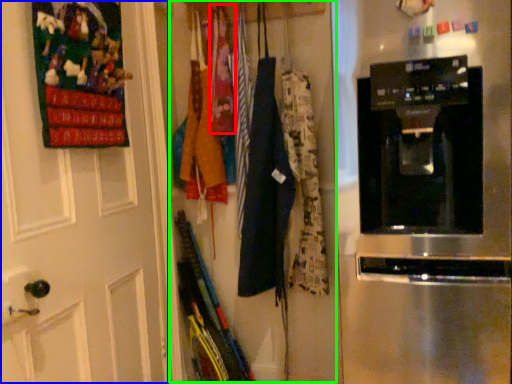
Question: Based on their relative distances, which object is nearer to clothing (highlighted by a red box)? Choose from door (highlighted by a blue box) and closet (highlighted by a green box).

Choices:
 (A) door
 (B) closet

Answer: (B)